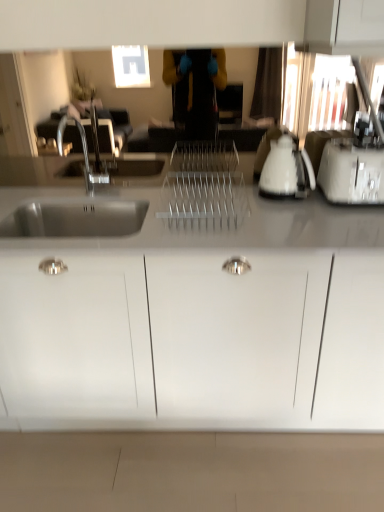
Question: Is white plastic toaster at right situated inside white glossy electric kettle at right or outside?

Choices:
 (A) outside
 (B) inside

Answer: (A)

Question: Is point (369, 197) positioned closer to the camera than point (281, 135)?

Choices:
 (A) closer
 (B) farther

Answer: (A)

Question: Which object is the farthest from the white matte cabinet at center?

Choices:
 (A) white glossy electric kettle at right
 (B) white plastic toaster at right

Answer: (B)

Question: Which object is the closest to the white matte cabinet at center?

Choices:
 (A) white glossy electric kettle at right
 (B) white plastic toaster at right

Answer: (A)